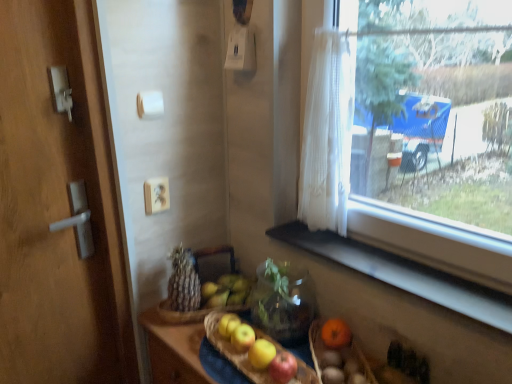
This screenshot has height=384, width=512. Find the location of `vacant location below transparent glass window at upper right (from a real-world perspective)`. vacant location below transparent glass window at upper right (from a real-world perspective) is located at coordinates (409, 261).